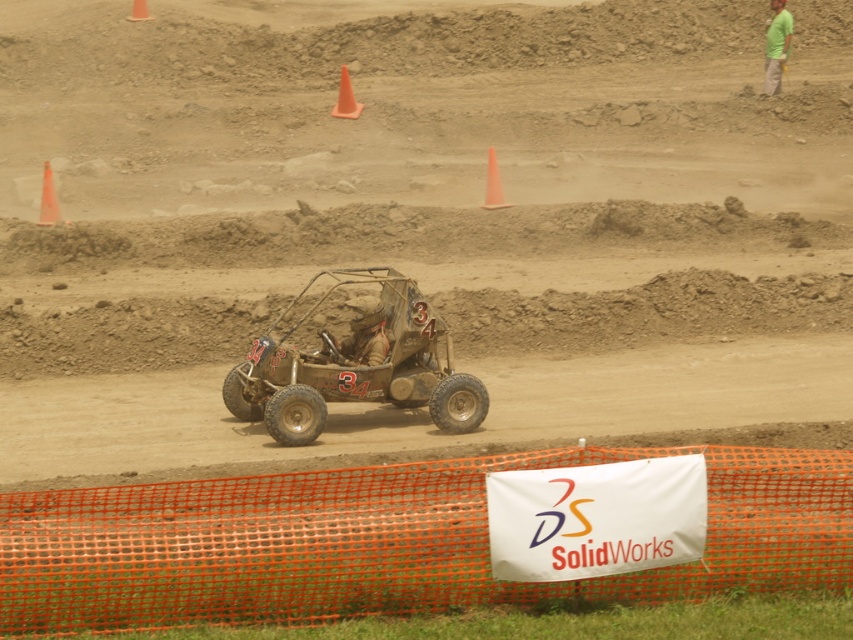
You are a photographer positioned at the center of the scene. You want to capture a photo of the green cotton shirt at upper right without including the offroad vehicle in the frame. Is the shirt positioned in a way that allows this?

The green cotton shirt at upper right is located at point (776, 45), which is outside the direct line of sight of the offroad vehicle. Therefore, you can capture the shirt without including the vehicle in the frame.

You are a race participant in the motocross event. You need to navigate around the orange mesh fence at lower center and the orange plastic cone at center. Which obstacle should you approach first?

You should approach the orange mesh fence at lower center first because it is closer to you than the orange plastic cone at center.

You are a driver in a buggie with a length of 4 meters. You need to navigate between the orange plastic cone at left and the orange plastic cone at center. Can your buggie fit through the gap between them?

The orange plastic cone at left and orange plastic cone at center are 4.70 meters apart. Since your buggie is 4 meters long, it can fit through the gap between them as the distance between the cones is greater than the buggie length.